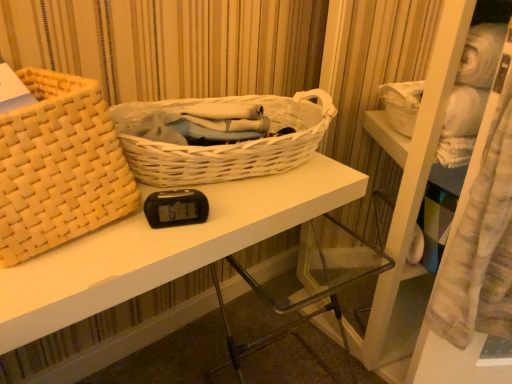
Question: Is white wicker basket at center, acting as the 2th picnic basket starting from the left, taller or shorter than matte woven picnic basket at left, positioned as the 1th picnic basket in left-to-right order?

Choices:
 (A) tall
 (B) short

Answer: (B)

Question: From the image's perspective, relative to matte woven picnic basket at left, positioned as the 1th picnic basket in left-to-right order, is white wicker basket at center, acting as the 2th picnic basket starting from the left, above or below?

Choices:
 (A) above
 (B) below

Answer: (A)

Question: Considering the real-world distances, which object is closest to the matte woven picnic basket at left, positioned as the 1th picnic basket in left-to-right order?

Choices:
 (A) white wicker basket at center, arranged as the first picnic basket when viewed from the right
 (B) white woven basket at upper left

Answer: (B)

Question: Which is nearer to the white wicker basket at center, acting as the 2th picnic basket starting from the left?

Choices:
 (A) white woven basket at upper left
 (B) matte woven picnic basket at left, the 2th picnic basket when ordered from right to left

Answer: (A)